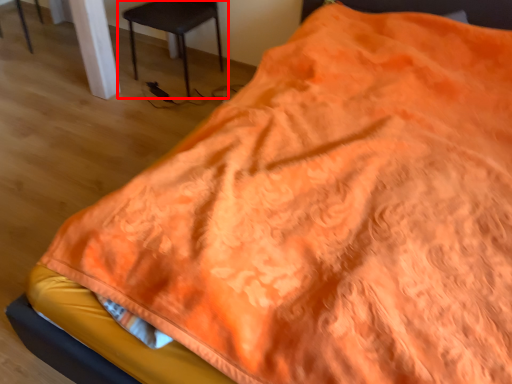
Question: From the image, what is the correct spatial relationship of chair (annotated by the red box) in relation to chair?

Choices:
 (A) left
 (B) right

Answer: (B)